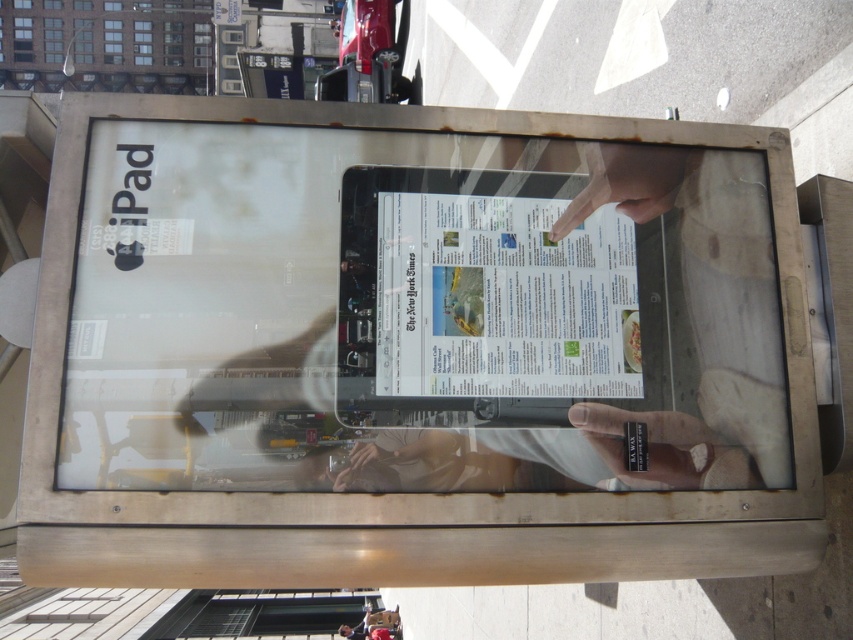
Consider the image. You are a security guard observing a kiosk advertisement for an iPad. You notice a smooth skin hand at lower center and a matte black ring at center. Which object is larger in size?

The smooth skin hand at lower center is bigger than the matte black ring at center.

From the picture: You are a photographer taking a picture of the iPad advertisement on the kiosk screen. You notice the smooth skin hand at lower center and the matte black ring at center in the reflection. Which object appears closer to you in the reflection?

The smooth skin hand at lower center appears closer to you in the reflection because it is closer to the viewer than the matte black ring at center.